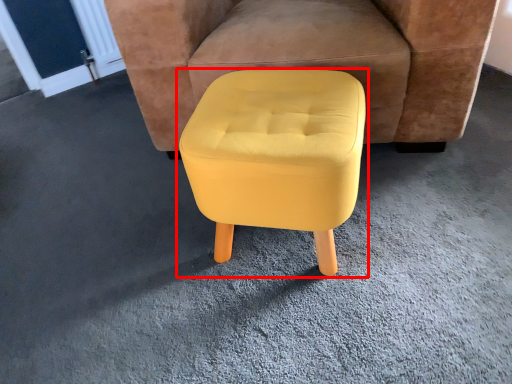
Question: From the image's perspective, considering the relative positions of stool (annotated by the red box) and chair in the image provided, where is stool (annotated by the red box) located with respect to the staircase?

Choices:
 (A) above
 (B) below

Answer: (B)